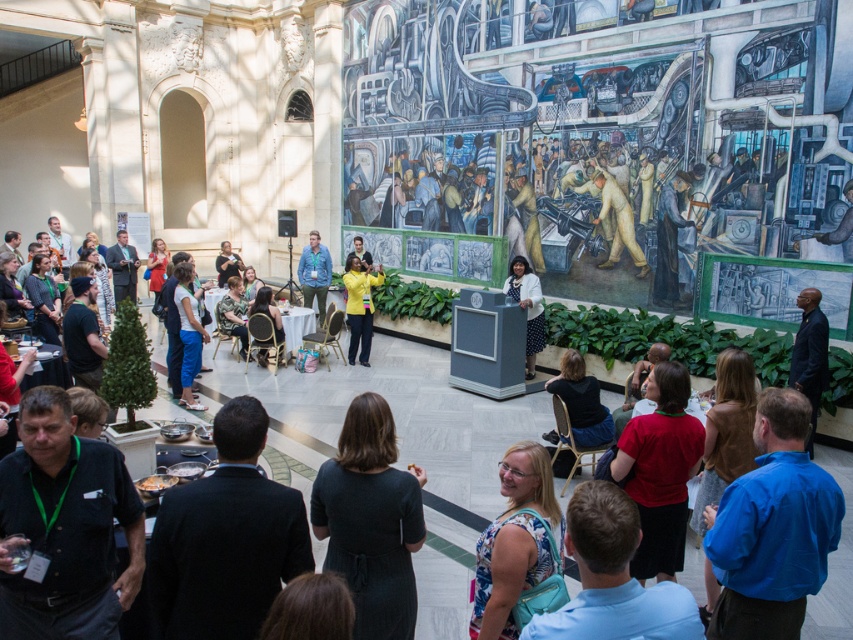
You are a photographer at the event and want to capture a photo of the white dotted dress at center without the matte yellow jacket at center blocking it. What should you do?

Move to a position where the white dotted dress at center is no longer behind the matte yellow jacket at center, such as moving to the side or adjusting your angle to ensure the dress is visible without obstruction.

You are standing at the entrance of the hall and see a woman in a yellow top at the center. There is a point marked at coordinates [515,541]. According to the image, where is this point located?

The point marked at coordinates [515,541] is located on the floral dress at center.

You are standing at the entrance of the hall and want to walk to the point marked as point (x=514, y=474). If your walking speed is 1.2 meters per second, how many seconds will it take to reach there?

The distance of point (x=514, y=474) from camera is 2.88 meters. At a walking speed of 1.2 meters per second, it would take 2.88 divided by 1.2 equals 2.4 seconds to reach the point.